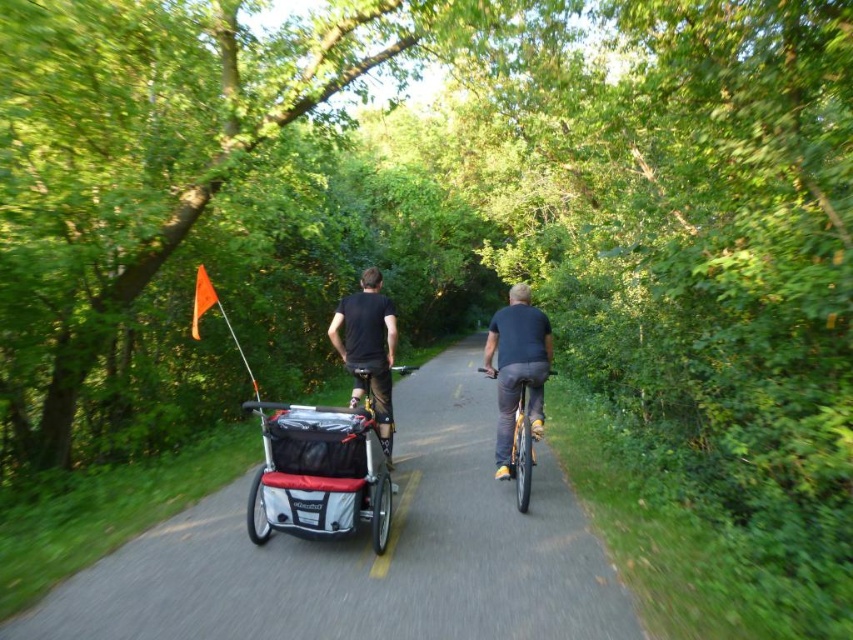
Question: Among these objects, which one is farthest from the camera?

Choices:
 (A) dark blue shirt at center
 (B) black matte shirt at center

Answer: (B)

Question: Is black matte shirt at center bigger than shiny silver bicycle at center?

Choices:
 (A) no
 (B) yes

Answer: (B)

Question: Does black matte shirt at center have a greater width compared to shiny silver bicycle at center?

Choices:
 (A) no
 (B) yes

Answer: (B)

Question: Observing the image, what is the correct spatial positioning of black plastic stroller at center in reference to shiny silver bicycle at center?

Choices:
 (A) above
 (B) below

Answer: (B)

Question: Estimate the real-world distances between objects in this image. Which object is farther from the black matte shirt at center?

Choices:
 (A) shiny silver bicycle at center
 (B) black plastic stroller at center

Answer: (B)

Question: Among these points, which one is nearest to the camera?

Choices:
 (A) (517, 396)
 (B) (332, 340)
 (C) (421, 512)
 (D) (491, 374)

Answer: (C)